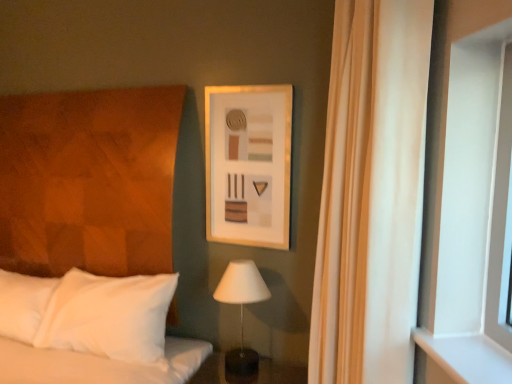
What do you see at coordinates (248, 164) in the screenshot? The image size is (512, 384). I see `matte wooden picture frame at upper center` at bounding box center [248, 164].

Image resolution: width=512 pixels, height=384 pixels. What do you see at coordinates (241, 309) in the screenshot?
I see `white matte table lamp at center` at bounding box center [241, 309].

The width and height of the screenshot is (512, 384). What do you see at coordinates (467, 197) in the screenshot?
I see `white matte window at right` at bounding box center [467, 197].

Locate an element on the screen. The image size is (512, 384). matte wooden picture frame at upper center is located at coordinates (248, 164).

Considering the points (260, 172) and (234, 360), which point is behind, point (260, 172) or point (234, 360)?

The point (260, 172) is farther.

Measure the distance between matte wooden picture frame at upper center and white matte table lamp at center.

matte wooden picture frame at upper center is 15.91 inches away from white matte table lamp at center.

Looking at the image, does matte wooden picture frame at upper center seem bigger or smaller compared to white matte table lamp at center?

Considering their sizes, matte wooden picture frame at upper center takes up less space than white matte table lamp at center.

This screenshot has width=512, height=384. What are the coordinates of `picture frame on the right side of white matte table lamp at center` in the screenshot? It's located at (248, 164).

Which of these two, white matte table lamp at center or beige fabric curtain at right, is thinner?

white matte table lamp at center.

The height and width of the screenshot is (384, 512). I want to click on table lamp below the beige fabric curtain at right (from the image's perspective), so click(x=241, y=309).

Looking at this image, is beige fabric curtain at right completely or partially inside white matte table lamp at center?

No.

Is white matte table lamp at center positioned in front of beige fabric curtain at right?

No, white matte table lamp at center is further to the viewer.

Is white matte window at right far from matte wooden picture frame at upper center?

No, white matte window at right is not far away from matte wooden picture frame at upper center.

In terms of size, does white matte window at right appear bigger or smaller than matte wooden picture frame at upper center?

white matte window at right is smaller than matte wooden picture frame at upper center.

From a real-world perspective, is white matte window at right positioned under matte wooden picture frame at upper center based on gravity?

Correct, in the physical world, white matte window at right is lower than matte wooden picture frame at upper center.

From the image's perspective, does white matte window at right appear lower than matte wooden picture frame at upper center?

Yes, from the image's perspective, white matte window at right is below matte wooden picture frame at upper center.

Consider the image. Is beige fabric curtain at right to the right of white matte window at right from the viewer's perspective?

No, beige fabric curtain at right is not to the right of white matte window at right.

Who is taller, beige fabric curtain at right or white matte window at right?

With more height is beige fabric curtain at right.

Between beige fabric curtain at right and white matte window at right, which one has larger width?

beige fabric curtain at right is wider.

Is beige fabric curtain at right completely or partially outside of white matte window at right?

Yes, beige fabric curtain at right is outside of white matte window at right.

From the picture: Is beige fabric curtain at right oriented away from white matte table lamp at center?

That's not correct — beige fabric curtain at right is not looking away from white matte table lamp at center.

Can you tell me how much beige fabric curtain at right and white matte table lamp at center differ in facing direction?

70.8 degrees.

Is white matte table lamp at center inside beige fabric curtain at right?

No, white matte table lamp at center is located outside of beige fabric curtain at right.

Is matte wooden picture frame at upper center positioned with its back to beige fabric curtain at right?

That's not correct — matte wooden picture frame at upper center is not looking away from beige fabric curtain at right.

How different are the orientations of matte wooden picture frame at upper center and beige fabric curtain at right in degrees?

matte wooden picture frame at upper center and beige fabric curtain at right are facing 62.5 degrees away from each other.

Is matte wooden picture frame at upper center to the right of beige fabric curtain at right from the viewer's perspective?

No.

Which of these two, matte wooden picture frame at upper center or beige fabric curtain at right, is thinner?

Thinner between the two is matte wooden picture frame at upper center.

Can you confirm if white matte window at right is shorter than beige fabric curtain at right?

Correct, white matte window at right is not as tall as beige fabric curtain at right.

How many degrees apart are the facing directions of white matte window at right and beige fabric curtain at right?

The angular difference between white matte window at right and beige fabric curtain at right is 90 degrees.

I want to click on curtain below the white matte window at right (from a real-world perspective), so click(x=370, y=192).

The width and height of the screenshot is (512, 384). In order to click on picture frame lying on the right of white matte table lamp at center in this screenshot , I will do `click(248, 164)`.

The height and width of the screenshot is (384, 512). Identify the location of table lamp below the beige fabric curtain at right (from a real-world perspective). (241, 309).

Consider the image. From the image, which object appears to be nearer to white matte window at right, matte wooden picture frame at upper center or white matte table lamp at center?

Among the two, matte wooden picture frame at upper center is located nearer to white matte window at right.

Based on their spatial positions, is matte wooden picture frame at upper center or white matte window at right further from beige fabric curtain at right?

matte wooden picture frame at upper center.

Looking at the image, which one is located further to white matte table lamp at center, matte wooden picture frame at upper center or white matte window at right?

Among the two, white matte window at right is located further to white matte table lamp at center.

Estimate the real-world distances between objects in this image. Which object is closer to white matte table lamp at center, white matte window at right or matte wooden picture frame at upper center?

Based on the image, matte wooden picture frame at upper center appears to be nearer to white matte table lamp at center.

Looking at the image, which one is located further to matte wooden picture frame at upper center, white matte window at right or beige fabric curtain at right?

white matte window at right.

Estimate the real-world distances between objects in this image. Which object is further from white matte window at right, white matte table lamp at center or beige fabric curtain at right?

Based on the image, white matte table lamp at center appears to be further to white matte window at right.

Which object lies nearer to the anchor point matte wooden picture frame at upper center, white matte table lamp at center or white matte window at right?

The object closer to matte wooden picture frame at upper center is white matte table lamp at center.

From the picture: Estimate the real-world distances between objects in this image. Which object is closer to matte wooden picture frame at upper center, beige fabric curtain at right or white matte window at right?

beige fabric curtain at right.

Where is `table lamp between white matte window at right and matte wooden picture frame at upper center in the front-back direction`? table lamp between white matte window at right and matte wooden picture frame at upper center in the front-back direction is located at coordinates (241, 309).

Where is `window between beige fabric curtain at right and matte wooden picture frame at upper center from front to back`? This screenshot has width=512, height=384. window between beige fabric curtain at right and matte wooden picture frame at upper center from front to back is located at coordinates 467,197.

Where is `window between beige fabric curtain at right and white matte table lamp at center from front to back`? window between beige fabric curtain at right and white matte table lamp at center from front to back is located at coordinates (467, 197).

Identify the location of table lamp located between beige fabric curtain at right and matte wooden picture frame at upper center in the depth direction. This screenshot has width=512, height=384. (241, 309).